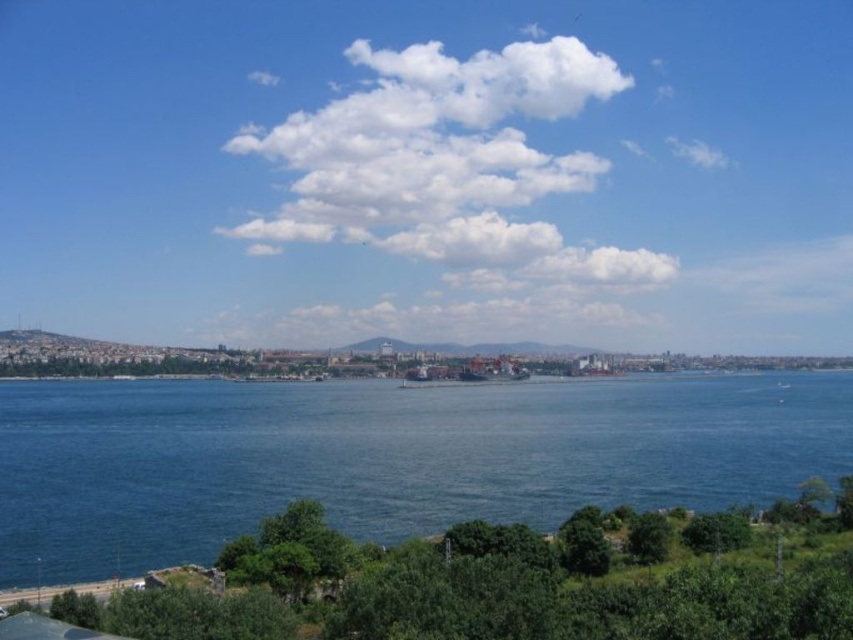
Who is positioned more to the left, blue liquid water at lower center or white fluffy cloud at upper center?

From the viewer's perspective, blue liquid water at lower center appears more on the left side.

Is blue liquid water at lower center to the left of white fluffy cloud at upper center from the viewer's perspective?

Yes, blue liquid water at lower center is to the left of white fluffy cloud at upper center.

What do you see at coordinates (386, 458) in the screenshot? I see `blue liquid water at lower center` at bounding box center [386, 458].

I want to click on blue liquid water at lower center, so click(x=386, y=458).